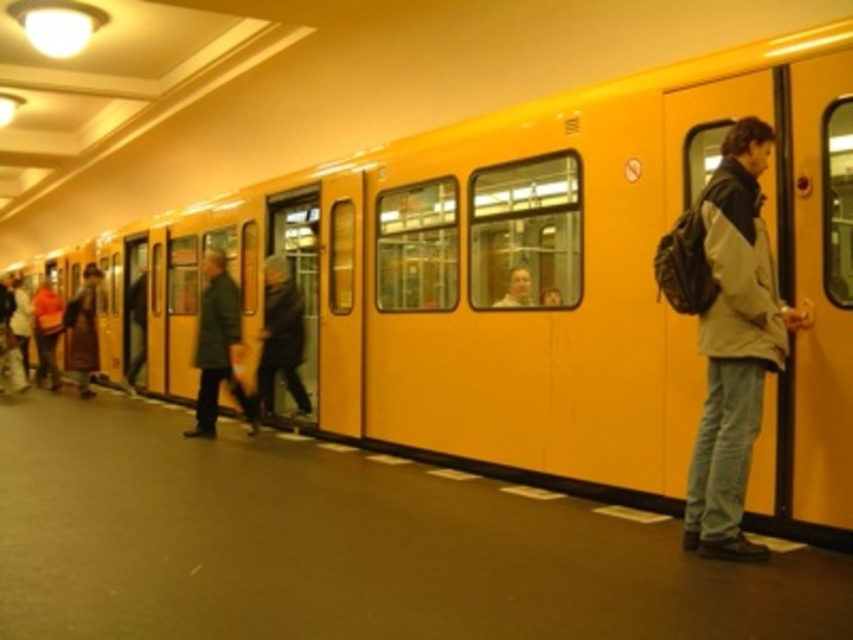
Question: Which of the following is the farthest from the observer?

Choices:
 (A) (294, 387)
 (B) (216, 262)
 (C) (722, 500)

Answer: (B)

Question: Does matte gray jacket at right appear on the right side of dark brown leather jacket at center?

Choices:
 (A) yes
 (B) no

Answer: (A)

Question: Which object appears farthest from the camera in this image?

Choices:
 (A) dark brown leather jacket at center
 (B) green wool coat at center

Answer: (A)

Question: Does green wool coat at center have a lesser width compared to dark brown leather jacket at center?

Choices:
 (A) no
 (B) yes

Answer: (A)

Question: Is matte gray jacket at right positioned before green wool coat at center?

Choices:
 (A) yes
 (B) no

Answer: (A)

Question: Among these points, which one is nearest to the camera?

Choices:
 (A) click(x=206, y=388)
 (B) click(x=753, y=163)

Answer: (B)